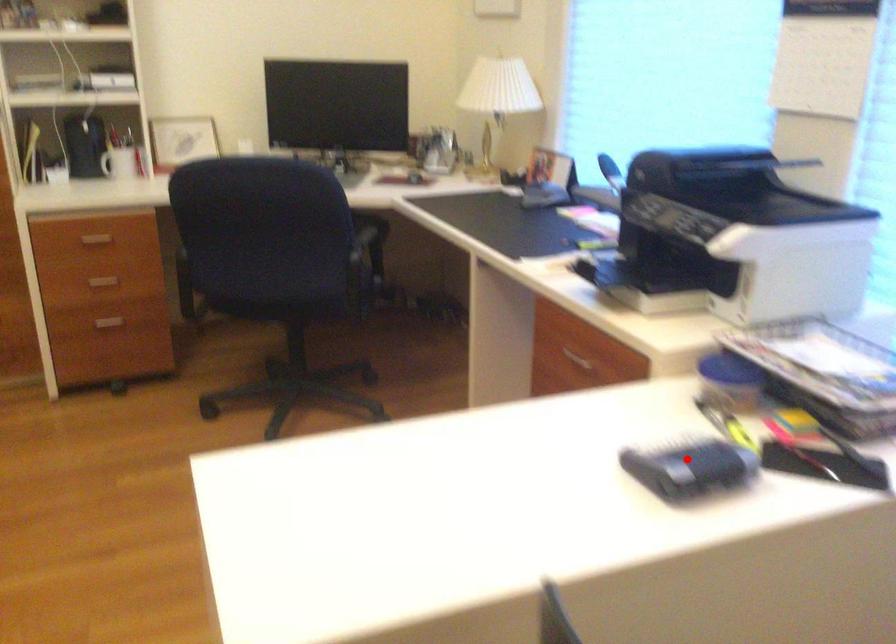
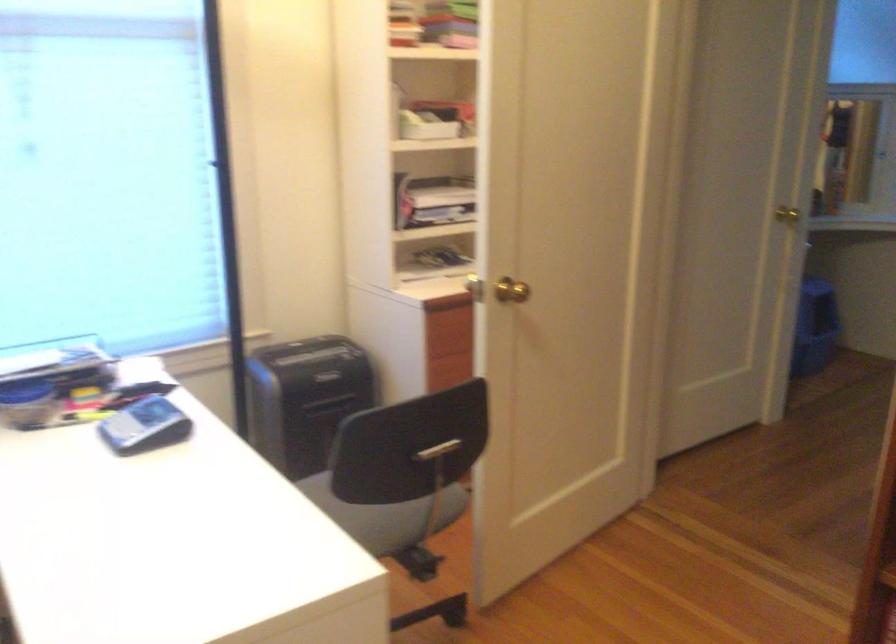
The point at the highlighted location is marked in the first image. Where is the corresponding point in the second image?

(143, 426)